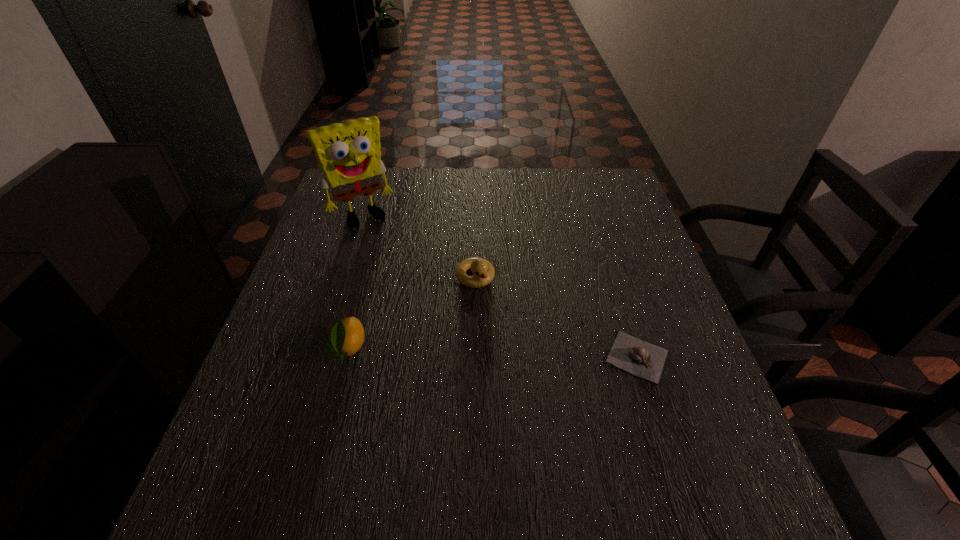
Image resolution: width=960 pixels, height=540 pixels. Identify the location of vacant region that satisfies the following two spatial constraints: 1. with leaves positioned above the shortest object; 2. on the right side of the lemon. (346, 356).

The image size is (960, 540). Find the location of `vacant position in the image that satisfies the following two spatial constraints: 1. on the front side of the third nearest object; 2. on the right side of the sponge`. vacant position in the image that satisfies the following two spatial constraints: 1. on the front side of the third nearest object; 2. on the right side of the sponge is located at coordinates (343, 278).

At what (x,y) coordinates should I click in order to perform the action: click on blank space that satisfies the following two spatial constraints: 1. with leaves positioned above the shortest object; 2. on the right side of the lemon. Please return your answer as a coordinate pair (x, y). This screenshot has width=960, height=540. Looking at the image, I should click on (346, 356).